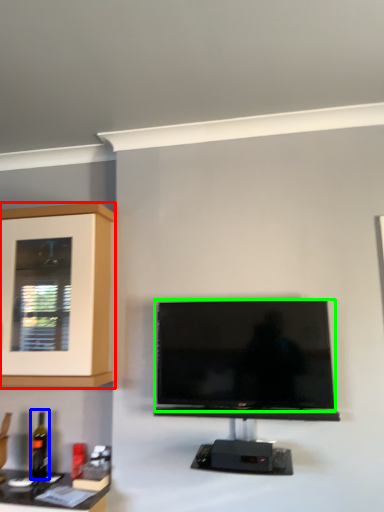
Question: Which object is positioned closest to cabinetry (highlighted by a red box)? Select from bottle (highlighted by a blue box) and television (highlighted by a green box).

Choices:
 (A) bottle
 (B) television

Answer: (B)